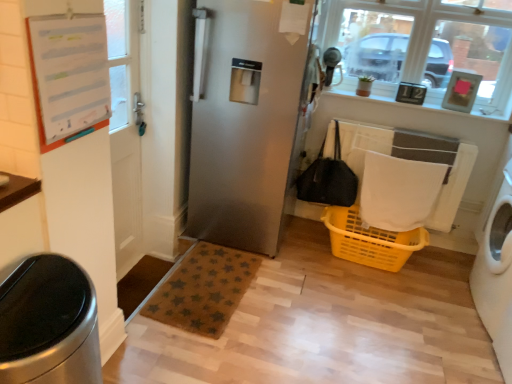
Identify the location of free area in between satin silver refrigerator at center and yellow plastic laundry basket at lower center. (322, 266).